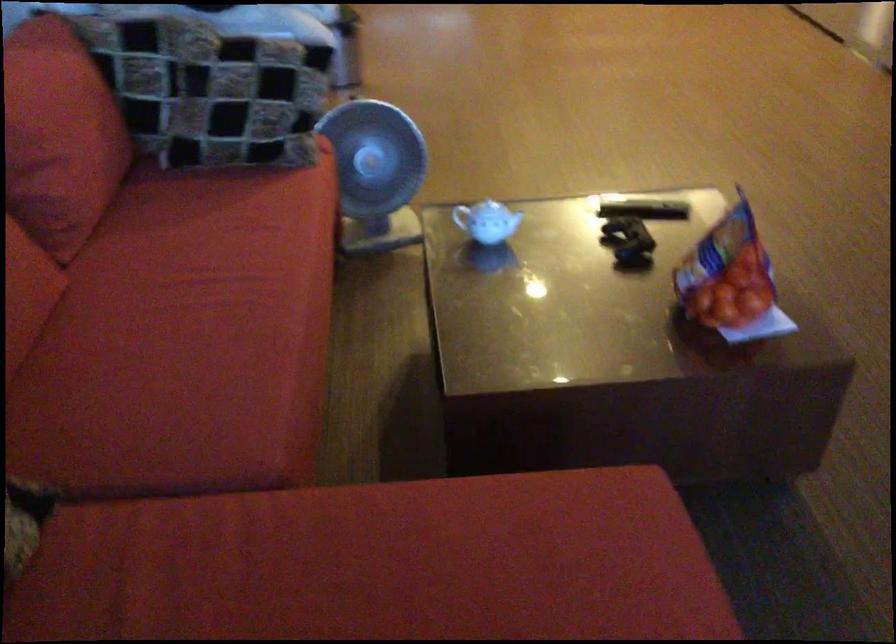
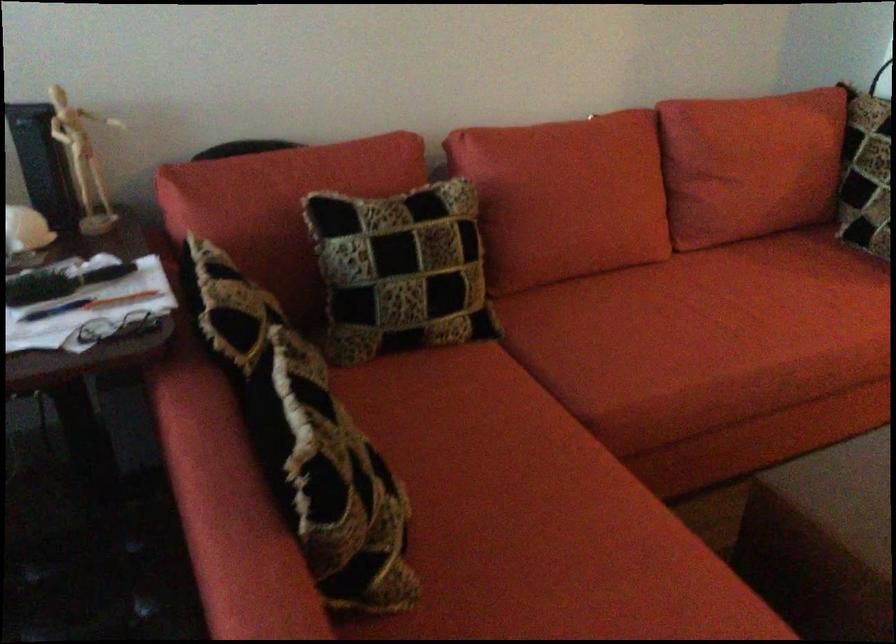
In the second image, find the point that corresponds to (230,307) in the first image.

(726, 323)